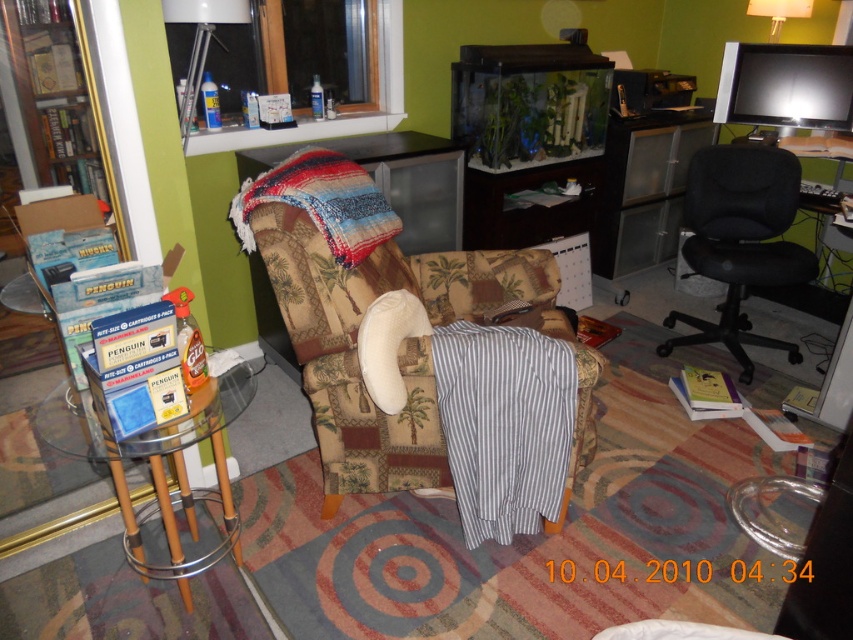
You are a delivery person carrying a package that requires a clear path of 5 feet to move through. You need to navigate from the wooden bookshelf at left to the patterned fabric couch at center. Is there enough space for you to move through the path between them?

The distance between the patterned fabric couch at center and wooden bookshelf at left is 4.90 feet, which is slightly less than the required 5 feet. Therefore, there isn not enough space for the delivery person to move through the path between them with the required clearance.

You are a delivery person who just arrived at the apartment. You need to place a large package that is 10 feet long between the black fabric swivel chair at right and the wooden bookshelf at left. Is there enough space between them to fit the package?

The distance between the black fabric swivel chair at right and the wooden bookshelf at left is 8.72 feet. Since the package is 10 feet long, it will not fit between them as the space is shorter than the package.

You are trying to decide whether to place a new rectangular side table between the black fabric swivel chair at right and the wooden bookshelf at left. The table is 1.2 meters wide. Can the table fit in the space between them?

The black fabric swivel chair at right has a lesser width compared to wooden bookshelf at left. However, the exact distance between them isn not provided in the Objects Description. Therefore, it is unclear if the table will fit without additional measurements.